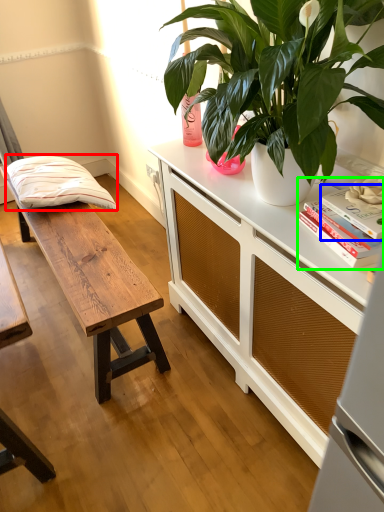
Question: Considering the real-world distances, which object is closest to pillow (highlighted by a red box)? book (highlighted by a blue box) or book (highlighted by a green box).

Choices:
 (A) book
 (B) book

Answer: (B)